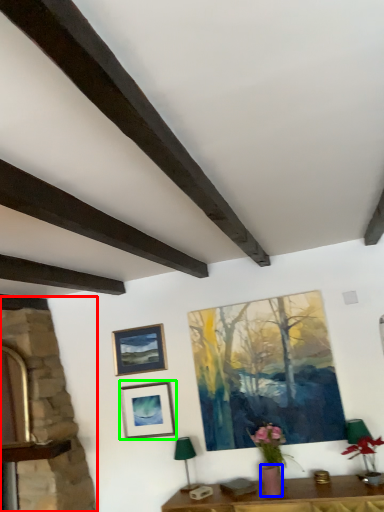
Question: Which is farther away from fireplace (highlighted by a red box)? flowerpot (highlighted by a blue box) or picture frame (highlighted by a green box)?

Choices:
 (A) flowerpot
 (B) picture frame

Answer: (A)